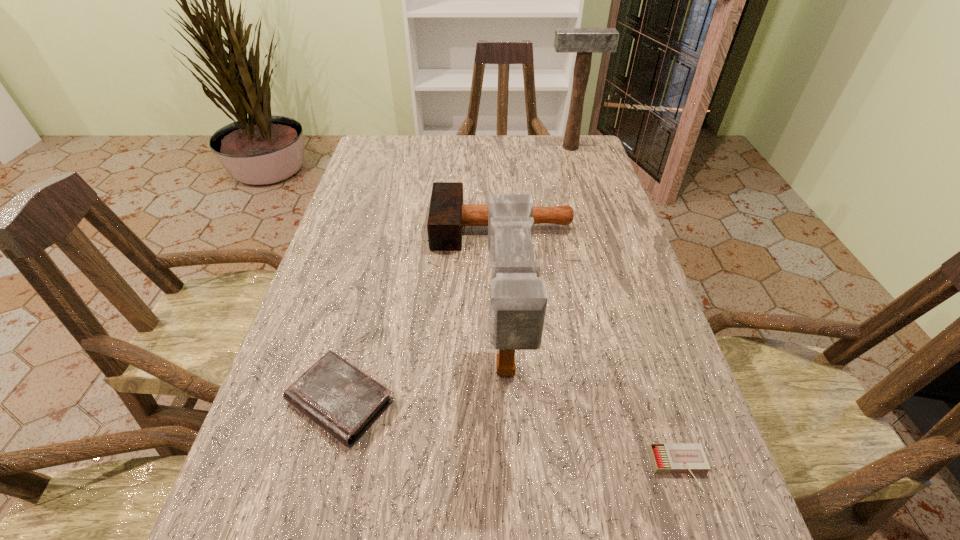
Where is `vacant space at the far left corner of the desktop`? vacant space at the far left corner of the desktop is located at coordinates (364, 151).

The width and height of the screenshot is (960, 540). What are the coordinates of `vacant area at the far right corner of the desktop` in the screenshot? It's located at (576, 153).

Image resolution: width=960 pixels, height=540 pixels. I want to click on vacant space that is in between the second nearest mallet and the shortest object, so click(590, 348).

Where is `vacant space that's between the matchbox and the leftmost object`? vacant space that's between the matchbox and the leftmost object is located at coordinates (510, 435).

I want to click on vacant space that's between the nearest mallet and the fourth tallest object, so click(423, 387).

In order to click on empty space that is in between the farthest object and the diary in this screenshot , I will do click(x=455, y=274).

Locate an element on the screen. The image size is (960, 540). free spot between the leftmost object and the shortest mallet is located at coordinates (421, 314).

Where is `free space between the shortest object and the nearest mallet`? free space between the shortest object and the nearest mallet is located at coordinates [592, 421].

Find the location of a particular element. vacant area that lies between the fourth tallest object and the farthest mallet is located at coordinates (455, 274).

Find the location of `object that ranks as the third closest to the nearest mallet`. object that ranks as the third closest to the nearest mallet is located at coordinates (x=447, y=215).